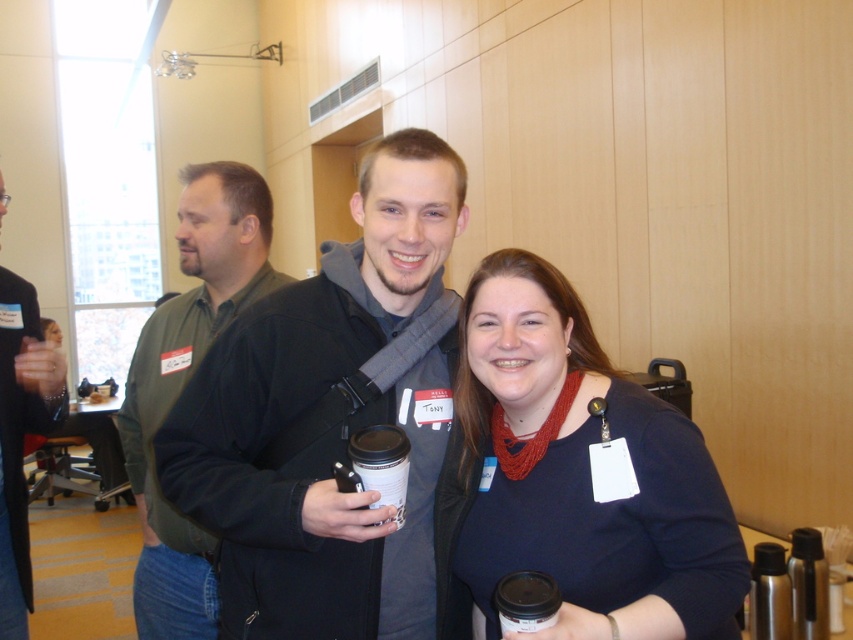
Question: In this image, where is black matte jacket at center located relative to green matte jacket at left?

Choices:
 (A) left
 (B) right

Answer: (B)

Question: Which object is positioned farthest from the black matte jacket at left?

Choices:
 (A) matte black cup at lower center
 (B) white paper cup at center

Answer: (A)

Question: Among these objects, which one is farthest from the camera?

Choices:
 (A) green matte jacket at left
 (B) black matte jacket at center
 (C) matte black cup at lower center

Answer: (A)

Question: In this image, where is black matte jacket at center located relative to green matte jacket at left?

Choices:
 (A) below
 (B) above

Answer: (B)

Question: Which of the following is the closest to the observer?

Choices:
 (A) (10, 564)
 (B) (517, 589)
 (C) (680, 506)

Answer: (B)

Question: Can you confirm if dark blue sweater at center is positioned below black matte jacket at left?

Choices:
 (A) no
 (B) yes

Answer: (B)